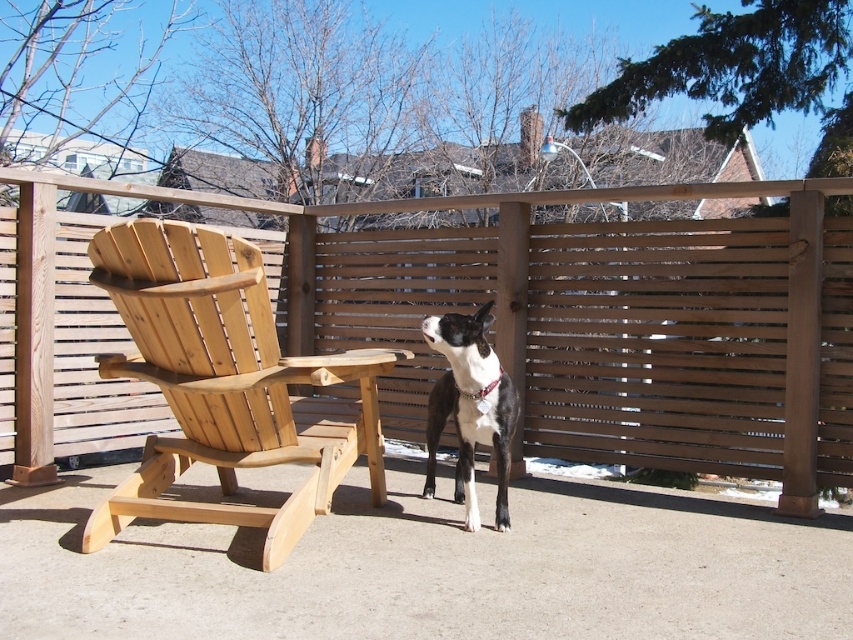
You are a small cat trying to jump from the natural wood rocking chair at left to the black and white fur at center. Can you make the jump if your maximum jump distance is 30 inches?

The natural wood rocking chair at left is 32.96 inches from the black and white fur at center, which is farther than the cat can jump. The cat cannot make the jump.

You are standing at the point marked by the coordinates point (503, 326). Looking around, you see a wooden Adirondack chair and a Boston Terrier dog. Which object is closer to you?

The point (503, 326) indicates brown wooden fence at center, so the brown wooden fence at center is closer to you than the wooden Adirondack chair and the Boston Terrier dog.

You are standing on the patio and see the brown wooden fence at center and the light brown wood at center. Which object is located to the right side from your perspective?

The brown wooden fence at center is located to the right of the light brown wood at center.